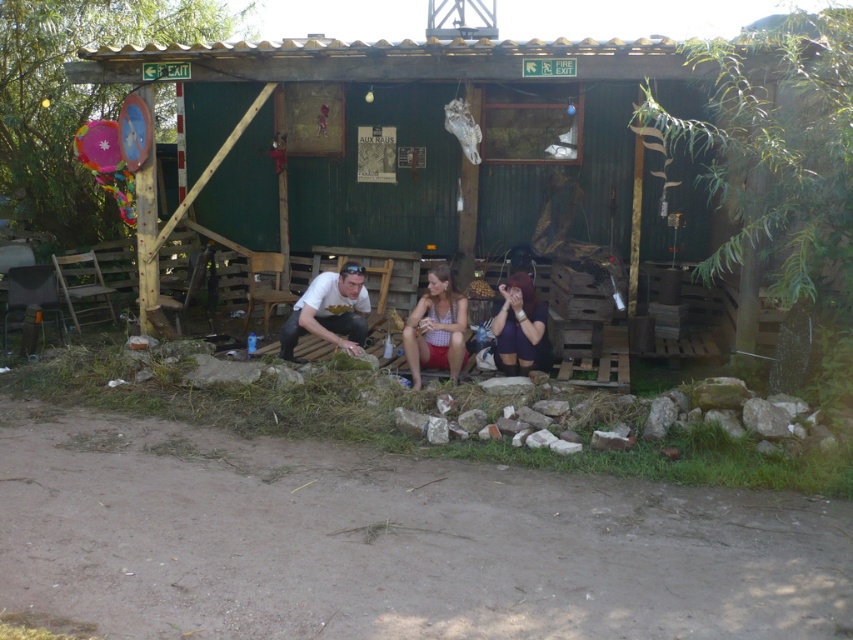
Question: Considering the relative positions of white matte shirt at lower center and matte white tank top at center in the image provided, where is white matte shirt at lower center located with respect to matte white tank top at center?

Choices:
 (A) right
 (B) left

Answer: (B)

Question: Which of the following is the closest to the observer?

Choices:
 (A) (509, 364)
 (B) (241, 90)

Answer: (A)

Question: Is white matte shirt at lower center closer to camera compared to matte white tank top at center?

Choices:
 (A) yes
 (B) no

Answer: (B)

Question: Which object is farther from the camera taking this photo?

Choices:
 (A) white matte shirt at lower center
 (B) matte white tank top at center
 (C) matte purple shorts at lower center

Answer: (A)

Question: Can you confirm if white matte shirt at lower center is positioned below matte purple shorts at lower center?

Choices:
 (A) yes
 (B) no

Answer: (A)

Question: Which point is closer to the camera?

Choices:
 (A) white matte shirt at lower center
 (B) green wooden cabin at center

Answer: (A)